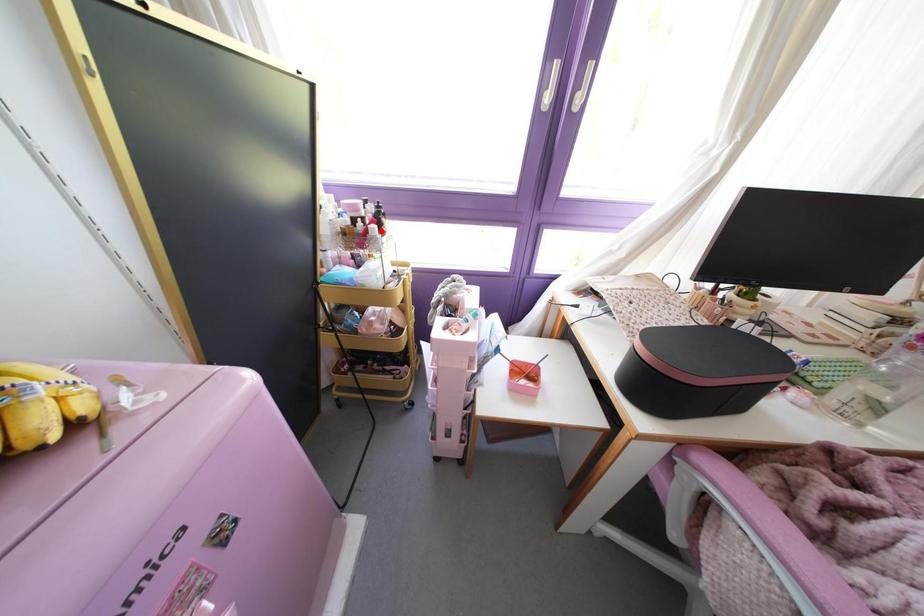
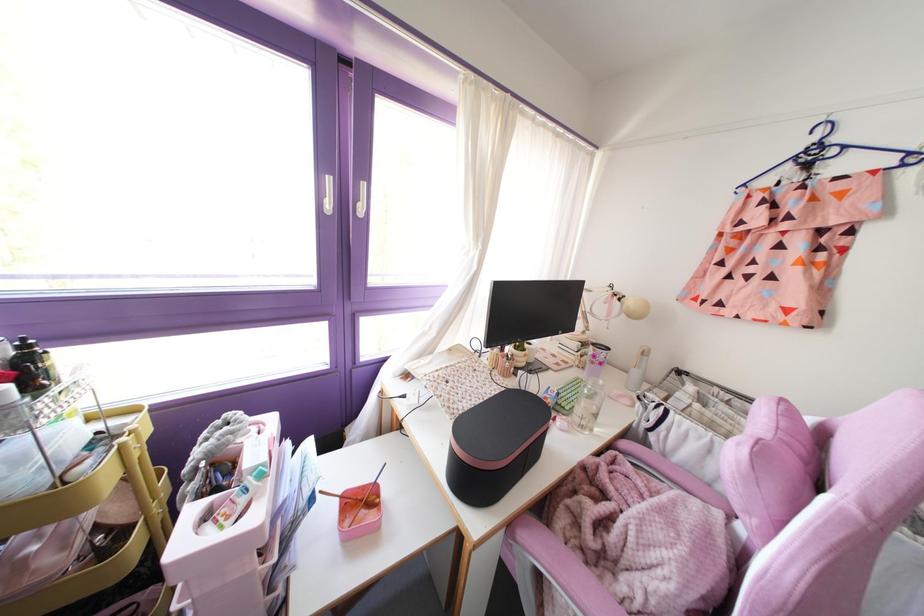
Question: I am providing you with two images of the same scene from different viewpoints. A red point is shown in image1. For the corresponding object point in image2, is it positioned nearer or farther from the camera?

Choices:
 (A) Nearer
 (B) Farther

Answer: (B)